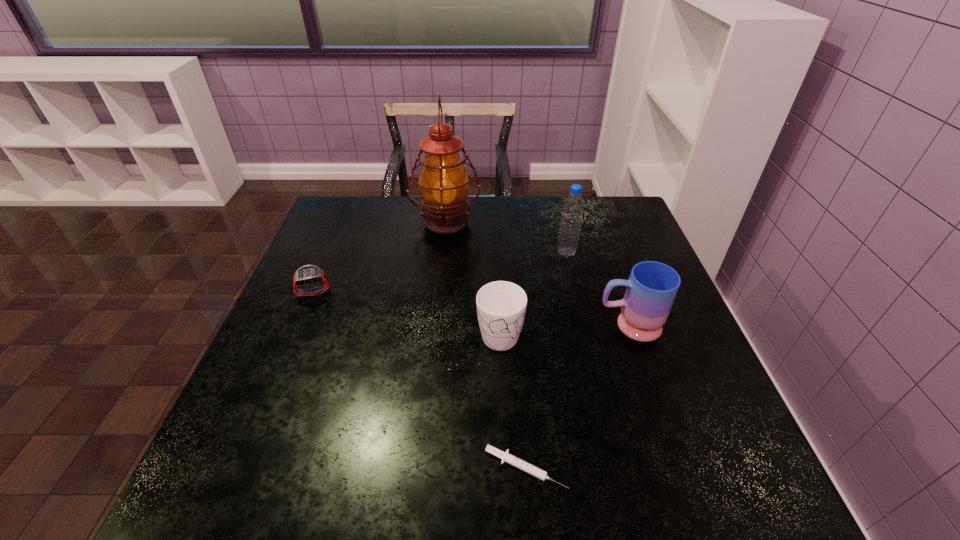
Where is `the tallest object`? the tallest object is located at coordinates (443, 183).

Find the location of `oil lamp`. oil lamp is located at coordinates (443, 183).

What are the coordinates of `water bottle` in the screenshot? It's located at (573, 208).

Where is `the fifth shortest object`? the fifth shortest object is located at coordinates (573, 208).

The width and height of the screenshot is (960, 540). I want to click on the third tallest object, so click(652, 287).

Locate an element on the screen. The width and height of the screenshot is (960, 540). the rightmost object is located at coordinates (652, 287).

The image size is (960, 540). In order to click on the third shortest object in this screenshot , I will do `click(501, 306)`.

Find the location of a particular element. the left mug is located at coordinates (501, 306).

What are the coordinates of `the second shortest object` in the screenshot? It's located at (306, 275).

I want to click on the leftmost object, so click(x=306, y=275).